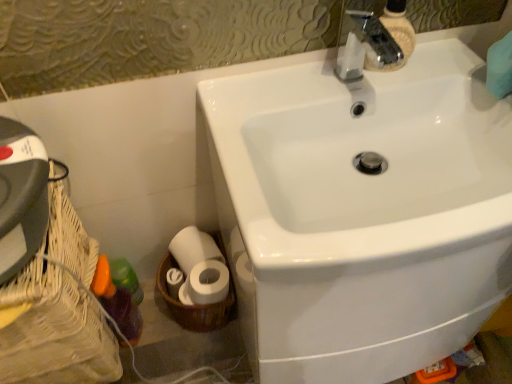
Question: From a real-world perspective, is translucent plastic bottle at lower left physically located above or below white glossy sink at upper right?

Choices:
 (A) above
 (B) below

Answer: (B)

Question: Looking at their shapes, would you say translucent plastic bottle at lower left is wider or thinner than white glossy sink at upper right?

Choices:
 (A) thin
 (B) wide

Answer: (A)

Question: Which of these objects is positioned closest to the translucent plastic bottle at lower left?

Choices:
 (A) white woven basket at lower left, which ranks as the 1th basket container in right-to-left order
 (B) translucent plastic bottle at lower left
 (C) woven wood basket at lower left, which is the second basket container from right to left
 (D) white glossy sink at upper right

Answer: (B)

Question: Which is farther from the translucent plastic bottle at lower left?

Choices:
 (A) woven wood basket at lower left, the first basket container when ordered from left to right
 (B) white woven basket at lower left, which appears as the second basket container when viewed from the left
 (C) white glossy sink at upper right
 (D) translucent plastic bottle at lower left

Answer: (C)